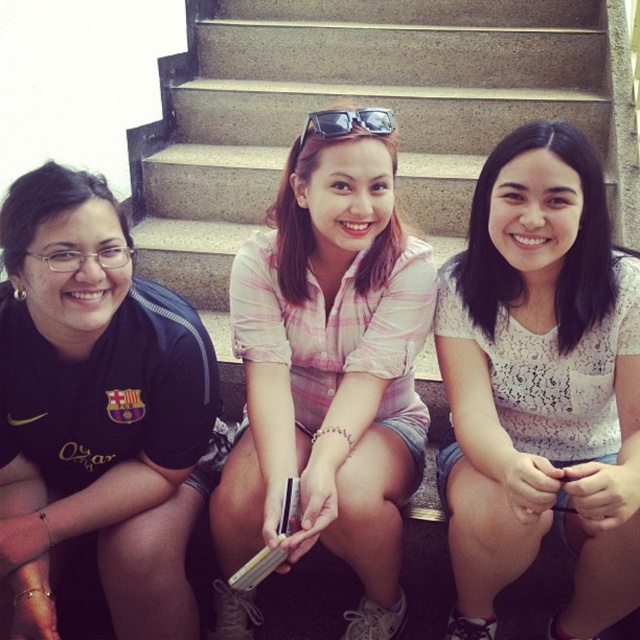
Does white lace blouse at center have a lesser height compared to black matte shirt at left?

Incorrect, white lace blouse at center's height does not fall short of black matte shirt at left's.

Between point (577, 422) and point (134, 593), which one is positioned in front?

Positioned in front is point (134, 593).

This screenshot has height=640, width=640. I want to click on white lace blouse at center, so click(x=540, y=385).

Can you confirm if black matte shirt at left is thinner than sunglasses at center?

In fact, black matte shirt at left might be wider than sunglasses at center.

Looking at this image, is black matte shirt at left closer to the viewer compared to sunglasses at center?

That is True.

Is point (163, 624) positioned before point (310, 125)?

No, it is behind (310, 125).

Image resolution: width=640 pixels, height=640 pixels. I want to click on black matte shirt at left, so click(97, 408).

Between pink plaid shirt at center and sunglasses at center, which one appears on the right side from the viewer's perspective?

sunglasses at center

Does pink plaid shirt at center have a lesser width compared to sunglasses at center?

No, pink plaid shirt at center is not thinner than sunglasses at center.

Between point (349, 544) and point (308, 132), which one is positioned behind?

Point (308, 132)

At what (x,y) coordinates should I click in order to perform the action: click on pink plaid shirt at center. Please return your answer as a coordinate pair (x, y). This screenshot has height=640, width=640. Looking at the image, I should click on (330, 371).